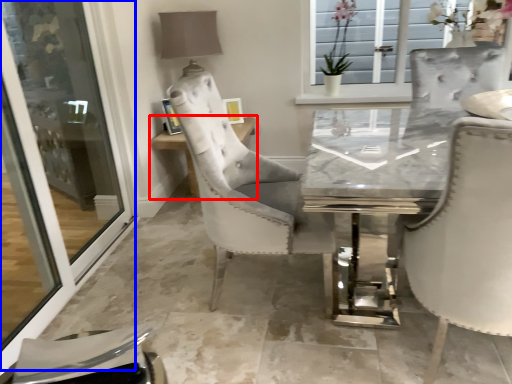
Question: Which of the following is the farthest to the observer, table (highlighted by a red box) or screen door (highlighted by a blue box)?

Choices:
 (A) table
 (B) screen door

Answer: (A)